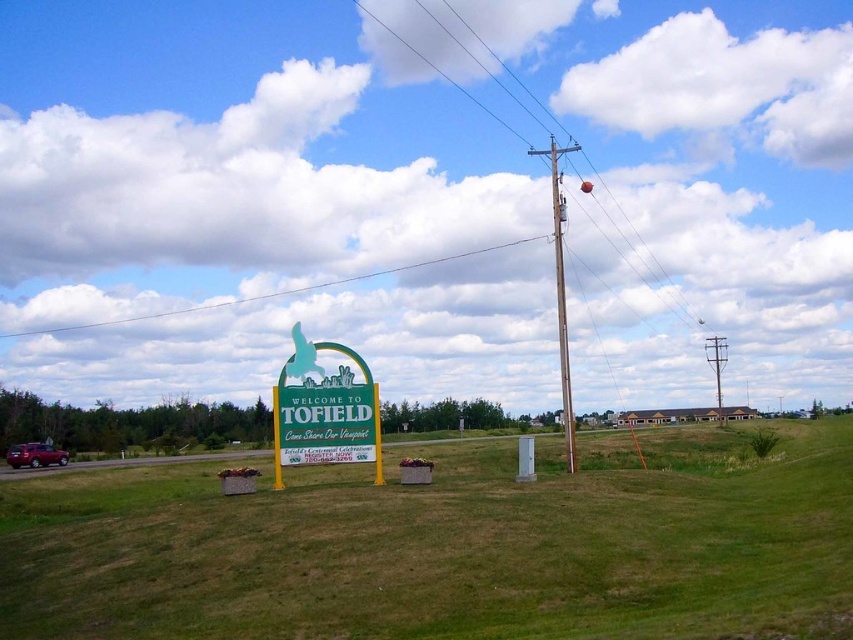
Question: Is green grassy field at center to the left of white wire at upper center from the viewer's perspective?

Choices:
 (A) no
 (B) yes

Answer: (A)

Question: Which point is farther to the camera?

Choices:
 (A) white wire at upper center
 (B) green plastic sign at center
 (C) metallic wire at upper center

Answer: (A)

Question: Is green grassy field at center smaller than green plastic sign at center?

Choices:
 (A) no
 (B) yes

Answer: (A)

Question: Which point is farther to the camera?

Choices:
 (A) (238, 298)
 (B) (338, 406)
 (C) (566, 412)

Answer: (A)

Question: Does metallic wire at upper center have a smaller size compared to brown wooden telegraph pole at upper center?

Choices:
 (A) yes
 (B) no

Answer: (B)

Question: Which object is closer to the camera taking this photo?

Choices:
 (A) metallic wire at upper center
 (B) white wire at upper center
 (C) green plastic sign at center

Answer: (C)